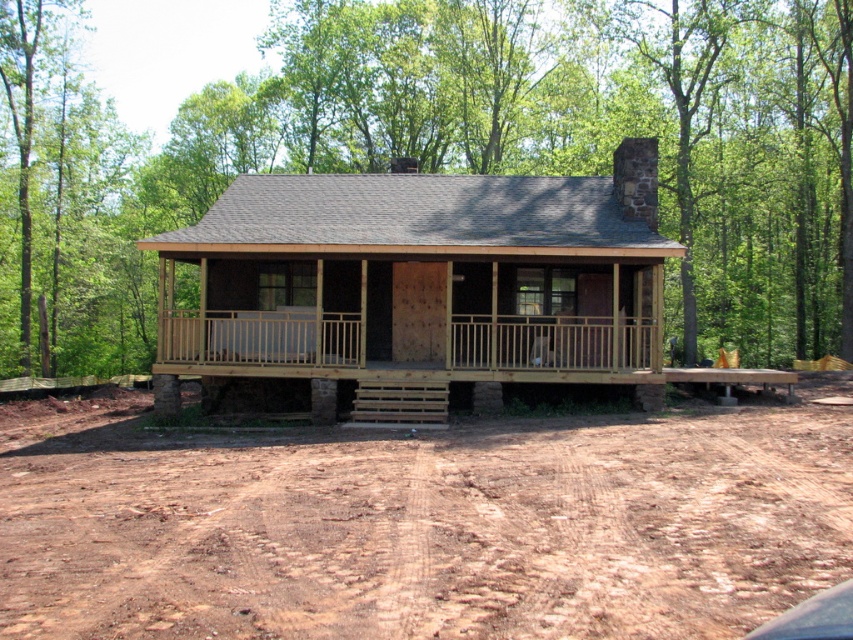
You are standing in front of the rustic wooden cabin and notice a green leafy tree at center and a natural wood porch at center. Which object is closer to you?

The green leafy tree at center is closer to you because it is in front of the natural wood porch at center.

You are planning to build a garden between the green leafy tree at center and the natural wood porch at center. The garden requires a minimum of 80 feet of space between them. Based on the image, will there be enough space for the garden?

The green leafy tree at center is 77.60 feet from the natural wood porch at center. Since the required space is 80 feet, there is not enough space for the garden.

You are standing at the camera position and want to reach the green leafy tree at center. The path is clear, but you have a 1.8m long ladder that you need to carry horizontally. Can you walk to the tree without tilting the ladder vertically?

The distance between you and the green leafy tree at center is 17.60 meters. Since the ladder is only 1.8 meters long, you can easily carry it horizontally while walking the 17.60 meters to the tree without needing to tilt it vertically.